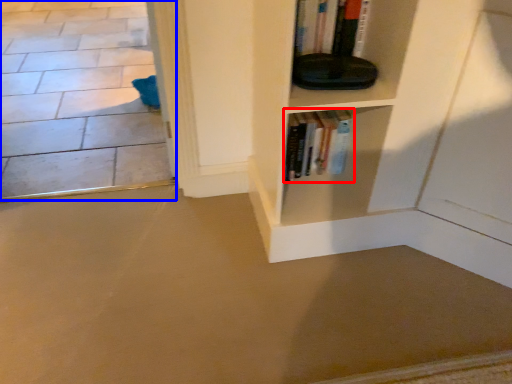
Question: Which of the following is the closest to the observer, book (highlighted by a red box) or concrete (highlighted by a blue box)?

Choices:
 (A) book
 (B) concrete

Answer: (A)